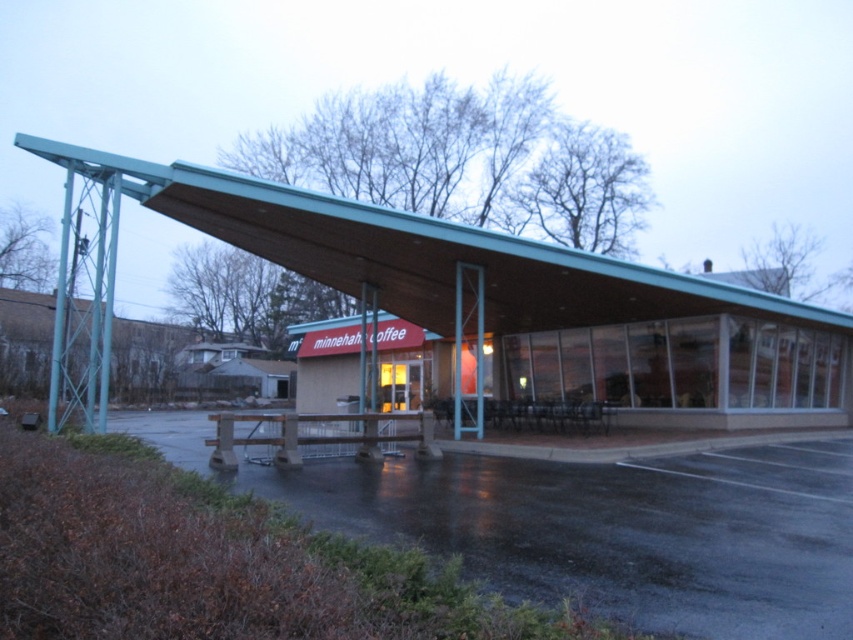
Question: Which of these objects is positioned closest to the black plastic picnic table at center?

Choices:
 (A) dark asphalt parking lot at lower left
 (B) teal wood shelter at center

Answer: (B)

Question: Which of the following is the farthest from the observer?

Choices:
 (A) black plastic picnic table at center
 (B) teal wood shelter at center

Answer: (A)

Question: Is teal wood shelter at center below black plastic picnic table at center?

Choices:
 (A) no
 (B) yes

Answer: (A)

Question: Based on their relative distances, which object is nearer to the dark asphalt parking lot at lower left?

Choices:
 (A) black plastic picnic table at center
 (B) teal wood shelter at center

Answer: (B)

Question: From the image, what is the correct spatial relationship of dark asphalt parking lot at lower left in relation to black plastic picnic table at center?

Choices:
 (A) left
 (B) right

Answer: (A)

Question: Can you confirm if dark asphalt parking lot at lower left is wider than black plastic picnic table at center?

Choices:
 (A) yes
 (B) no

Answer: (A)